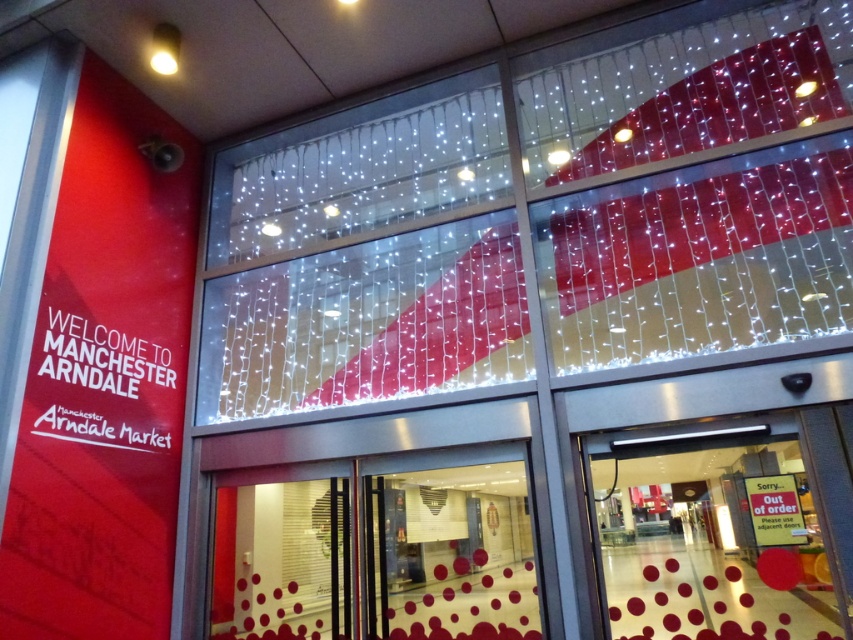
Question: Which object is farther from the camera taking this photo?

Choices:
 (A) transparent glass door at lower right
 (B) white string lights at upper center

Answer: (B)

Question: Does white string lights at upper center appear on the left side of transparent glass door at lower right?

Choices:
 (A) no
 (B) yes

Answer: (B)

Question: From the image, what is the correct spatial relationship of white string lights at upper center in relation to transparent glass door at lower right?

Choices:
 (A) below
 (B) above

Answer: (B)

Question: Which point is farther from the camera taking this photo?

Choices:
 (A) (440, 580)
 (B) (793, 508)
 (C) (393, 168)

Answer: (C)

Question: Can you confirm if white string lights at upper center is positioned to the left of metallic glass door at center?

Choices:
 (A) no
 (B) yes

Answer: (A)

Question: Which of these objects is positioned closest to the red plastic sign at lower right?

Choices:
 (A) white string lights at upper center
 (B) transparent glass door at lower right
 (C) metallic glass door at center

Answer: (B)